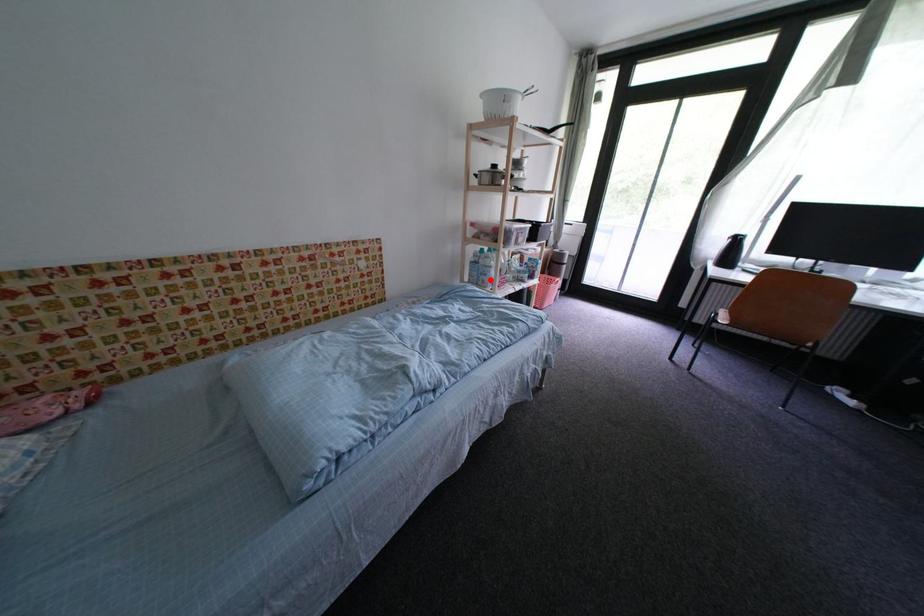
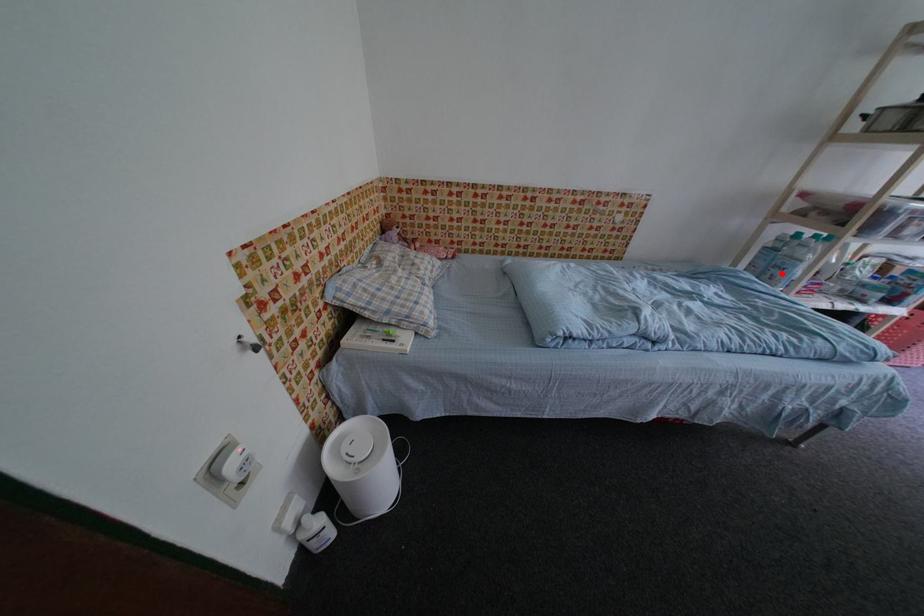
I am providing you with two images of the same scene from different viewpoints. A red point is marked on the first image and another point is marked on the second image. Are the points marked in image1 and image2 representing the same 3D position?

Yes